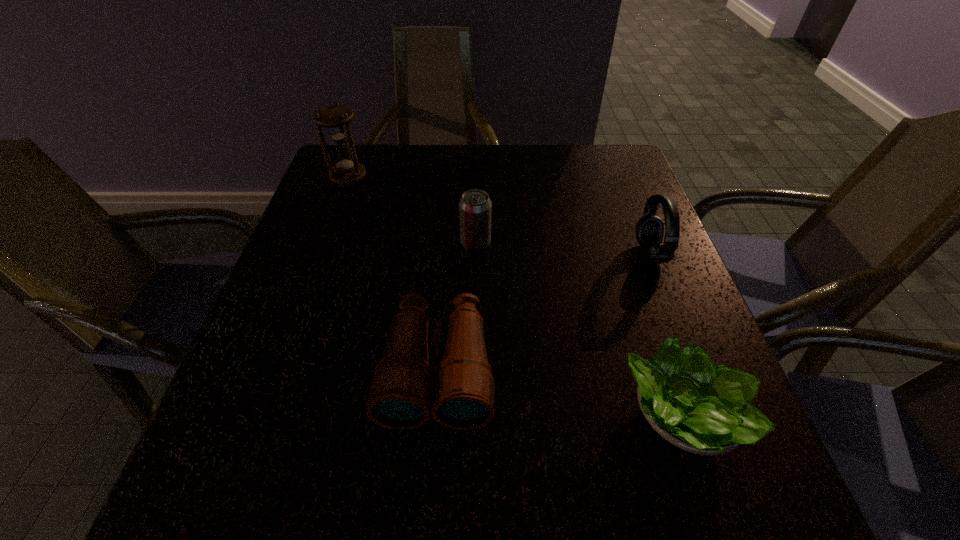
Identify the location of free space located 0.050m on the back of the soda can. The image size is (960, 540). (476, 220).

What are the coordinates of `vacant space situated through the lenses of the binoculars` in the screenshot? It's located at (428, 497).

I want to click on vacant space located 0.070m on the left of the lettuce, so click(579, 416).

The width and height of the screenshot is (960, 540). Identify the location of object present at the far edge. (335, 118).

Locate an element on the screen. The height and width of the screenshot is (540, 960). object that is at the near edge is located at coordinates (694, 406).

What are the coordinates of `object that is at the left edge` in the screenshot? It's located at point(335,118).

I want to click on headset that is at the right edge, so click(x=649, y=230).

This screenshot has width=960, height=540. I want to click on lettuce at the right edge, so click(694, 406).

Find the location of a particular element. Image resolution: width=960 pixels, height=540 pixels. object that is at the far left corner is located at coordinates (335, 118).

This screenshot has height=540, width=960. I want to click on object situated at the near right corner, so click(694, 406).